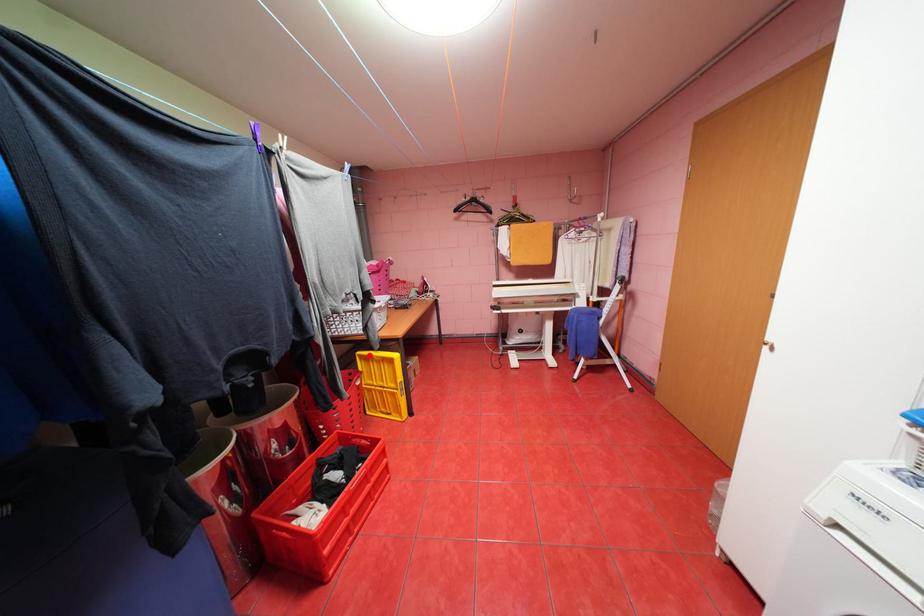
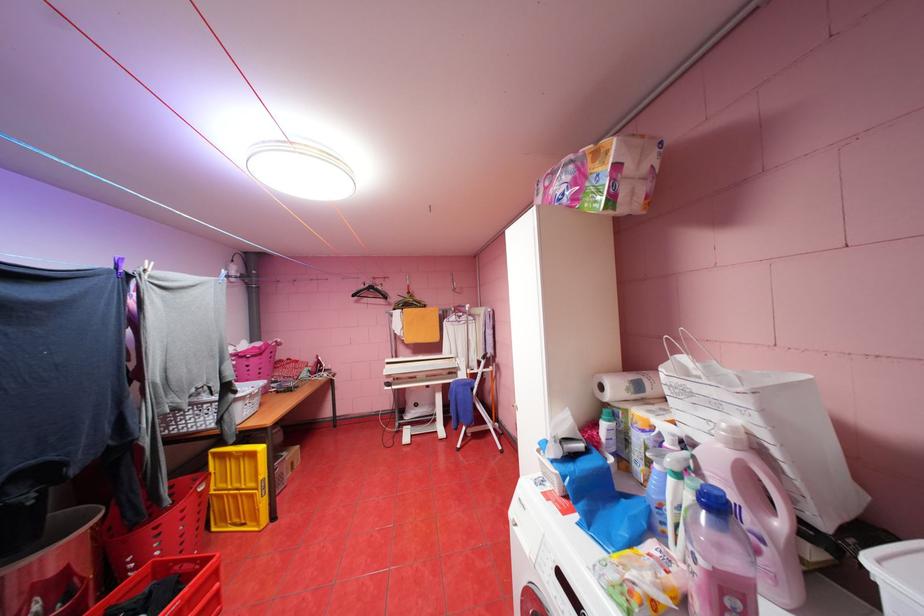
Question: I am providing you with two images of the same scene from different viewpoints. In image1, a red point is highlighted. Considering the same 3D point in image2, which of the following is correct?

Choices:
 (A) It is closer
 (B) It is farther

Answer: (B)